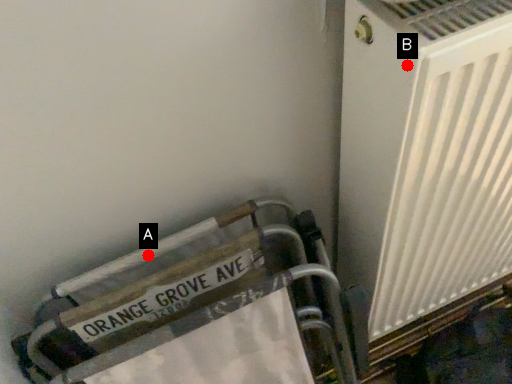
Question: Two points are circled on the image, labeled by A and B beside each circle. Which point is farther to the camera?

Choices:
 (A) A is further
 (B) B is further

Answer: (A)